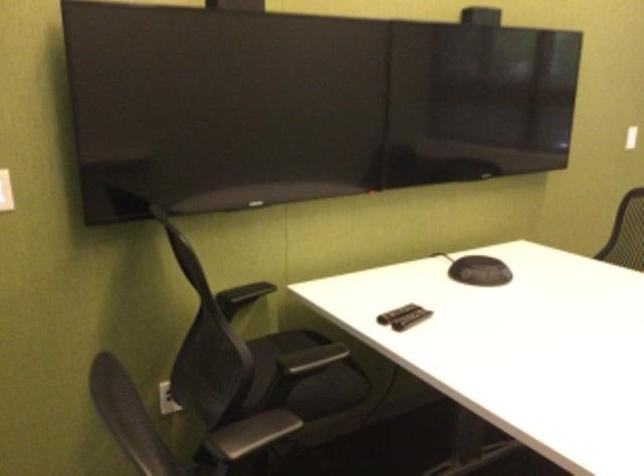
The width and height of the screenshot is (644, 476). Find the location of `black speakerphone`. black speakerphone is located at coordinates (480, 16).